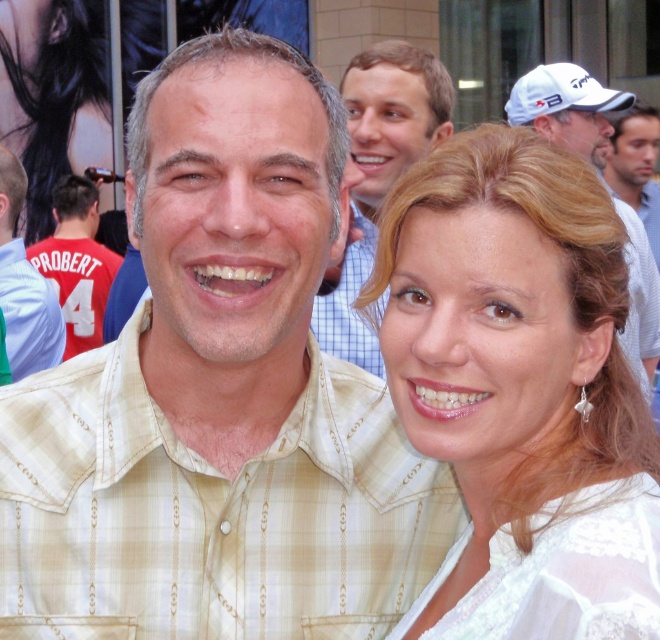
Which is more to the right, white cap at upper right or white textured cap at upper right?

Positioned to the right is white textured cap at upper right.

Between white cap at upper right and white textured cap at upper right, which one is positioned lower?

Positioned lower is white cap at upper right.

Does point (570, 93) come in front of point (618, 120)?

Yes, point (570, 93) is closer to viewer.

You are a GUI agent. You are given a task and a screenshot of the screen. Output one action in this format:
    pyautogui.click(x=<x>, y=<y>)
    Task: Click on the white cap at upper right
    Image resolution: width=660 pixels, height=640 pixels.
    Given the screenshot: What is the action you would take?
    pyautogui.click(x=566, y=108)

How far apart are white cap at upper right and red jersey at left?

white cap at upper right is 4.17 meters away from red jersey at left.

Between white cap at upper right and red jersey at left, which one appears on the left side from the viewer's perspective?

red jersey at left is more to the left.

At what (x,y) coordinates should I click in order to perform the action: click on white cap at upper right. Please return your answer as a coordinate pair (x, y). Image resolution: width=660 pixels, height=640 pixels. Looking at the image, I should click on (566, 108).

Who is taller, white lace blouse at upper right or red jersey at left?

With more height is red jersey at left.

Which is more to the right, white lace blouse at upper right or red jersey at left?

Positioned to the right is white lace blouse at upper right.

Who is more distant from viewer, (449, 385) or (104, 264)?

The point (104, 264) is more distant.

Identify the location of white lace blouse at upper right. This screenshot has height=640, width=660. (510, 339).